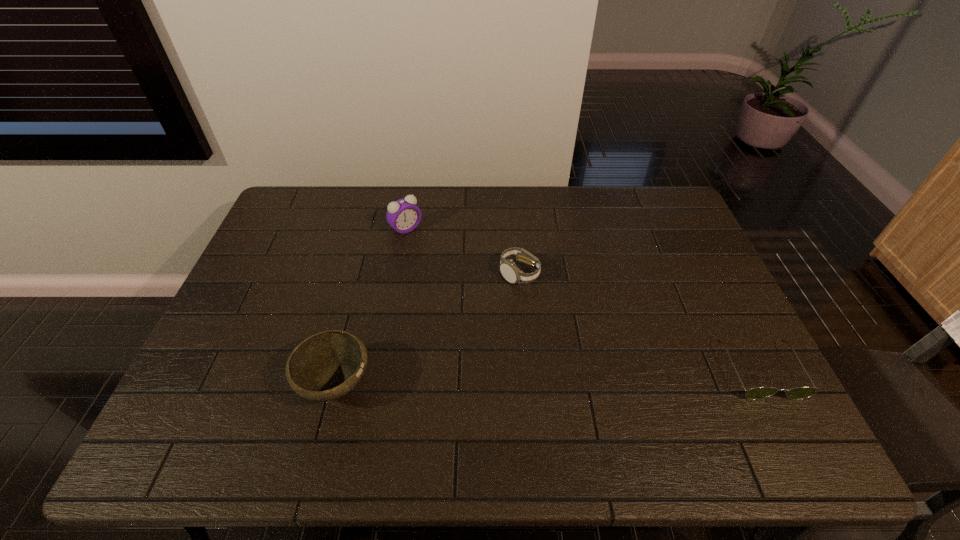
Find the location of a particular element. vacant space positioned on the face of the alarm clock is located at coordinates [x=488, y=309].

The image size is (960, 540). Find the location of `free spot located 0.220m on the face of the alarm clock`. free spot located 0.220m on the face of the alarm clock is located at coordinates (453, 275).

Locate an element on the screen. vacant space located on the face of the alarm clock is located at coordinates (473, 294).

In order to click on object that is at the far edge in this screenshot , I will do `click(403, 215)`.

The image size is (960, 540). Find the location of `bowl that is at the near edge`. bowl that is at the near edge is located at coordinates (325, 366).

Locate an element on the screen. sunglasses that is at the near edge is located at coordinates (756, 393).

The image size is (960, 540). Find the location of `object located in the right edge section of the desktop`. object located in the right edge section of the desktop is located at coordinates (756, 393).

Where is `object located at the near right corner`? object located at the near right corner is located at coordinates (756, 393).

Locate an element on the screen. This screenshot has width=960, height=540. vacant space at the far edge of the desktop is located at coordinates (327, 213).

The width and height of the screenshot is (960, 540). Find the location of `free space at the left edge`. free space at the left edge is located at coordinates (259, 264).